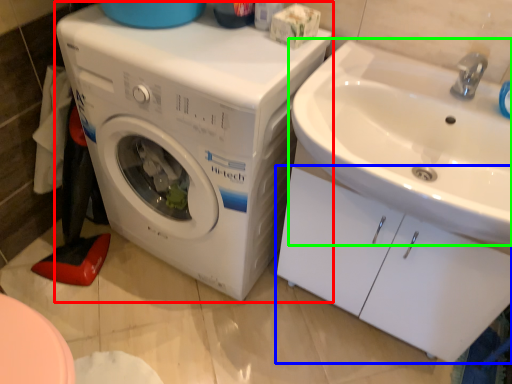
Question: Which object is the farthest from washing machine (highlighted by a red box)? Choose among these: drawer (highlighted by a blue box) or sink (highlighted by a green box).

Choices:
 (A) drawer
 (B) sink

Answer: (A)